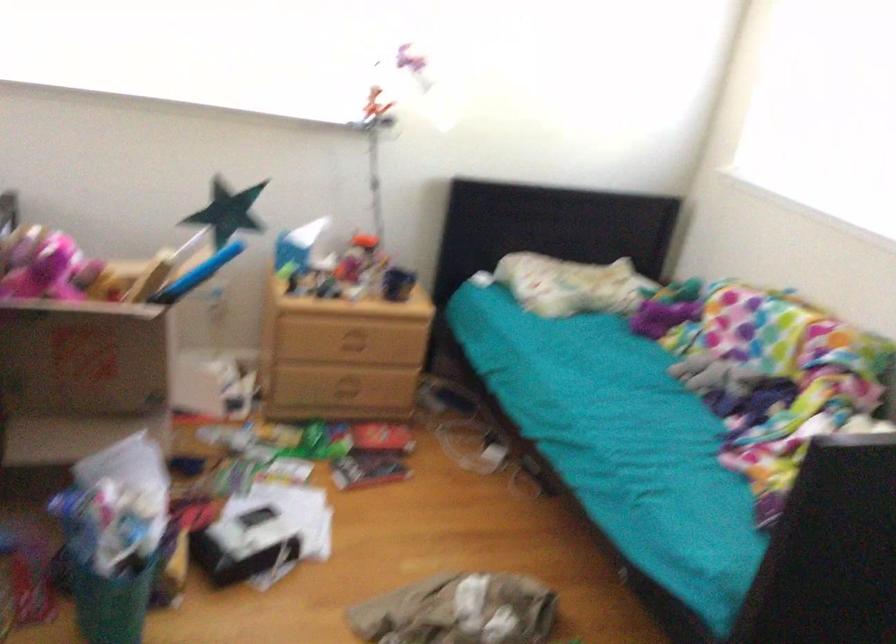
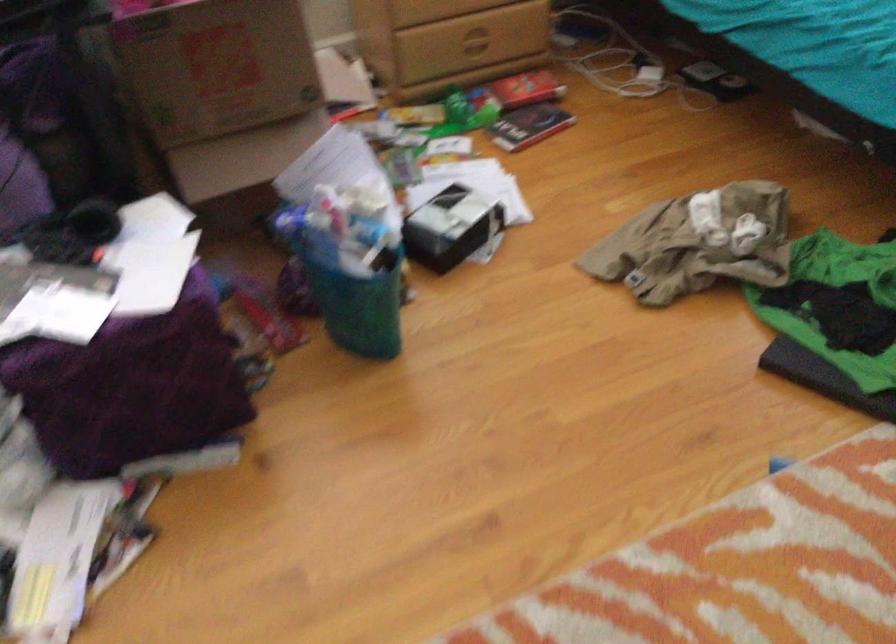
Find the pixel in the second image that matches [346,383] in the first image.

(472, 40)